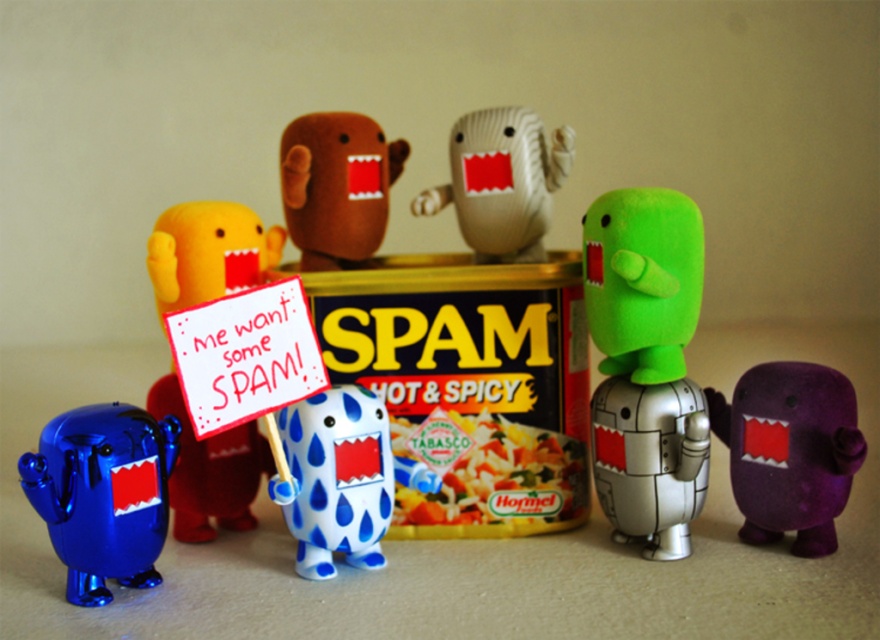
What do you see at coordinates (789, 451) in the screenshot? I see `purple felt toy at right` at bounding box center [789, 451].

Who is higher up, purple felt toy at right or yellow plush toy at center?

yellow plush toy at center is higher up.

The width and height of the screenshot is (880, 640). In order to click on purple felt toy at right in this screenshot , I will do `click(789, 451)`.

Who is positioned more to the left, purple felt toy at right or matte brown plush toy at center?

From the viewer's perspective, matte brown plush toy at center appears more on the left side.

Can you confirm if purple felt toy at right is positioned above matte brown plush toy at center?

No.

Between point (796, 364) and point (335, 186), which one is positioned behind?

The point (335, 186) is more distant.

Identify the location of purple felt toy at right. The height and width of the screenshot is (640, 880). (789, 451).

Is yellowish matte tabasco sauce at center bigger than matte beige plush toy at center?

No.

Who is higher up, yellowish matte tabasco sauce at center or matte beige plush toy at center?

matte beige plush toy at center is higher up.

Who is more distant from viewer, [495,456] or [534,208]?

Point [534,208]

Locate an element on the screen. Image resolution: width=880 pixels, height=640 pixels. yellowish matte tabasco sauce at center is located at coordinates (495, 477).